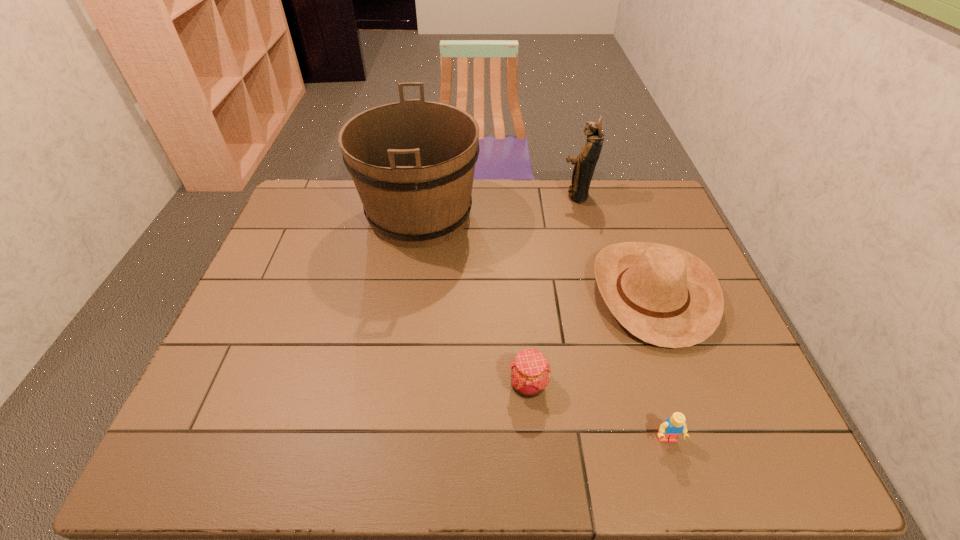
Where is `the tallest object`? the tallest object is located at coordinates (412, 162).

Identify the location of bucket. (412, 162).

The width and height of the screenshot is (960, 540). Identify the location of the fourth shortest object. (585, 163).

The height and width of the screenshot is (540, 960). Find the location of `the third tallest object`. the third tallest object is located at coordinates (663, 295).

The width and height of the screenshot is (960, 540). In order to click on the fourth farthest object in this screenshot , I will do `click(529, 371)`.

Identify the location of the second object from left to right. (529, 371).

The width and height of the screenshot is (960, 540). Find the location of `the nearest object`. the nearest object is located at coordinates (671, 428).

Identify the location of vacant region located 0.340m on the front of the leftmost object. (399, 353).

At what (x,y) coordinates should I click in order to perform the action: click on free region located on the front-facing side of the figurine. Please return your answer as a coordinate pair (x, y). The width and height of the screenshot is (960, 540). Looking at the image, I should click on (514, 195).

I want to click on free space located 0.380m on the front-facing side of the figurine, so click(451, 195).